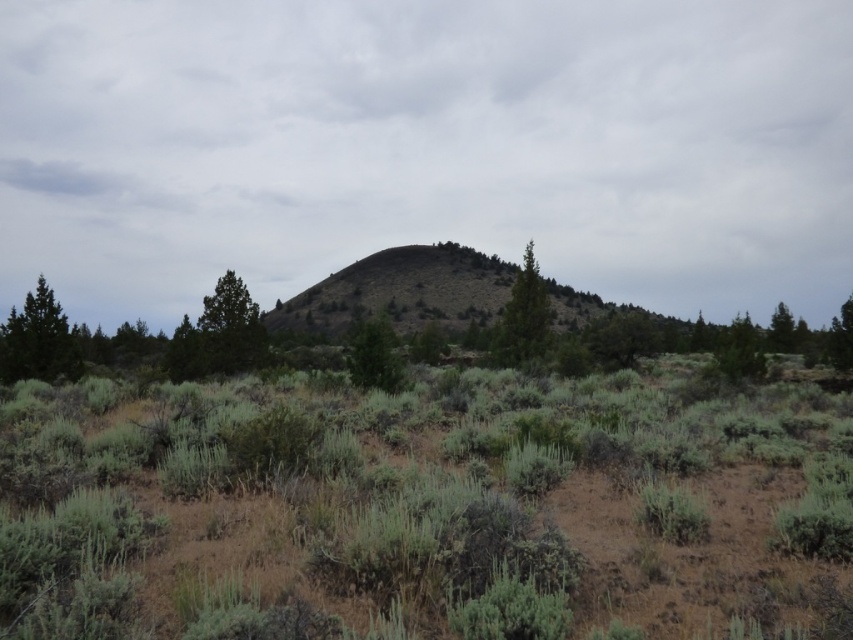
Question: Which point is farther to the camera?

Choices:
 (A) green leafy tree at center
 (B) green textured tree at upper center

Answer: (B)

Question: Which of these objects is positioned farthest from the green matte tree at left?

Choices:
 (A) green grassy hill at center
 (B) green textured tree at upper center
 (C) green textured tree at right

Answer: (A)

Question: Is green textured tree at left bigger than green matte tree at right?

Choices:
 (A) no
 (B) yes

Answer: (A)

Question: Does green matte tree at left have a smaller size compared to green textured tree at upper center?

Choices:
 (A) yes
 (B) no

Answer: (A)

Question: Based on their relative distances, which object is farther from the green matte tree at right?

Choices:
 (A) green leafy tree at center
 (B) green textured tree at right
 (C) green textured tree at upper center
 (D) green textured tree at left

Answer: (B)

Question: From the image, what is the correct spatial relationship of green textured tree at upper center in relation to green leafy tree at center?

Choices:
 (A) above
 (B) below

Answer: (A)